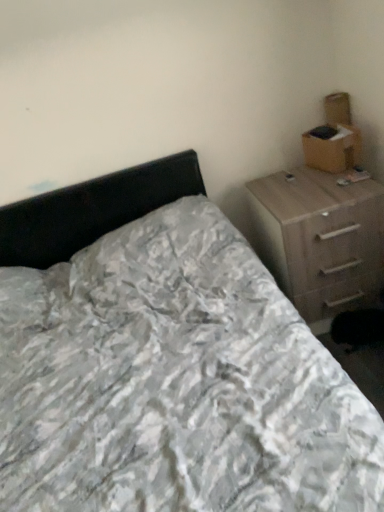
The width and height of the screenshot is (384, 512). Find the location of `brown cardboard box at upper right`. brown cardboard box at upper right is located at coordinates (332, 148).

This screenshot has width=384, height=512. Describe the element at coordinates (332, 148) in the screenshot. I see `brown cardboard box at upper right` at that location.

This screenshot has width=384, height=512. Identify the location of white textured bed at center. (165, 362).

The width and height of the screenshot is (384, 512). I want to click on brown cardboard box at upper right, so click(x=332, y=148).

From a real-world perspective, who is located higher, brown cardboard box at upper right or white textured bed at center?

brown cardboard box at upper right, from a real-world perspective.

How far apart are brown cardboard box at upper right and white textured bed at center?

brown cardboard box at upper right is 3.37 feet away from white textured bed at center.

At what (x,y) coordinates should I click in order to perform the action: click on bed located below the brown cardboard box at upper right (from the image's perspective). Please return your answer as a coordinate pair (x, y). Looking at the image, I should click on (165, 362).

Between brown cardboard box at upper right and white textured bed at center, which one has more height?

white textured bed at center is taller.

Is brown cardboard box at upper right spatially inside light brown wood chest of drawers at right, or outside of it?

The correct answer is: outside.

Is brown cardboard box at upper right taller than light brown wood chest of drawers at right?

No.

Is brown cardboard box at upper right facing towards light brown wood chest of drawers at right?

No, brown cardboard box at upper right is not aimed at light brown wood chest of drawers at right.

Is brown cardboard box at upper right not near light brown wood chest of drawers at right?

No, brown cardboard box at upper right is not far from light brown wood chest of drawers at right.

In the scene shown: Can you tell me how much light brown wood chest of drawers at right and brown cardboard box at upper right differ in facing direction?

The angle between the facing direction of light brown wood chest of drawers at right and the facing direction of brown cardboard box at upper right is 74.8 degrees.

Is light brown wood chest of drawers at right aimed at brown cardboard box at upper right?

No, light brown wood chest of drawers at right does not turn towards brown cardboard box at upper right.

Which object is thinner, light brown wood chest of drawers at right or brown cardboard box at upper right?

Thinner between the two is brown cardboard box at upper right.

Between light brown wood chest of drawers at right and brown cardboard box at upper right, which one is positioned in front?

light brown wood chest of drawers at right is more forward.

Does white textured bed at center appear on the right side of light brown wood chest of drawers at right?

Incorrect, white textured bed at center is not on the right side of light brown wood chest of drawers at right.

How different are the orientations of white textured bed at center and light brown wood chest of drawers at right in degrees?

They differ by 1.09 degrees in their facing directions.

Is light brown wood chest of drawers at right at the back of white textured bed at center?

white textured bed at center does not have its back to light brown wood chest of drawers at right.

Is white textured bed at center in contact with light brown wood chest of drawers at right?

white textured bed at center and light brown wood chest of drawers at right are clearly separated.

Between point (380, 461) and point (315, 156), which one is positioned in front?

Point (380, 461)

Which is in front, white textured bed at center or brown cardboard box at upper right?

white textured bed at center.

This screenshot has width=384, height=512. Find the location of `bed that is on the left side of brown cardboard box at upper right`. bed that is on the left side of brown cardboard box at upper right is located at coordinates (165, 362).

Is white textured bed at center to the left of brown cardboard box at upper right from the viewer's perspective?

Indeed, white textured bed at center is positioned on the left side of brown cardboard box at upper right.

Which is nearer, (271, 240) or (182, 422)?

Point (182, 422)

Considering the positions of objects light brown wood chest of drawers at right and white textured bed at center in the image provided, who is more to the left, light brown wood chest of drawers at right or white textured bed at center?

Positioned to the left is white textured bed at center.

Between light brown wood chest of drawers at right and white textured bed at center, which one has smaller size?

With smaller size is light brown wood chest of drawers at right.

Considering the relative sizes of light brown wood chest of drawers at right and white textured bed at center in the image provided, is light brown wood chest of drawers at right shorter than white textured bed at center?

Indeed, light brown wood chest of drawers at right has a lesser height compared to white textured bed at center.

This screenshot has width=384, height=512. Find the location of `bed on the left of brown cardboard box at upper right`. bed on the left of brown cardboard box at upper right is located at coordinates (165, 362).

Find the location of a particular element. cardboard box above the light brown wood chest of drawers at right (from a real-world perspective) is located at coordinates (332, 148).

Consider the image. Considering their positions, is white textured bed at center positioned further to brown cardboard box at upper right than light brown wood chest of drawers at right?

The object further to brown cardboard box at upper right is white textured bed at center.

When comparing their distances from white textured bed at center, does light brown wood chest of drawers at right or brown cardboard box at upper right seem further?

brown cardboard box at upper right is positioned further to the anchor white textured bed at center.

Based on their spatial positions, is brown cardboard box at upper right or light brown wood chest of drawers at right further from white textured bed at center?

Based on the image, brown cardboard box at upper right appears to be further to white textured bed at center.

Which object lies nearer to the anchor point light brown wood chest of drawers at right, brown cardboard box at upper right or white textured bed at center?

brown cardboard box at upper right lies closer to light brown wood chest of drawers at right than the other object.

When comparing their distances from light brown wood chest of drawers at right, does white textured bed at center or brown cardboard box at upper right seem closer?

Based on the image, brown cardboard box at upper right appears to be nearer to light brown wood chest of drawers at right.

Which object lies nearer to the anchor point brown cardboard box at upper right, light brown wood chest of drawers at right or white textured bed at center?

The object closer to brown cardboard box at upper right is light brown wood chest of drawers at right.

In order to click on chest of drawers between white textured bed at center and brown cardboard box at upper right from front to back in this screenshot , I will do `click(320, 239)`.